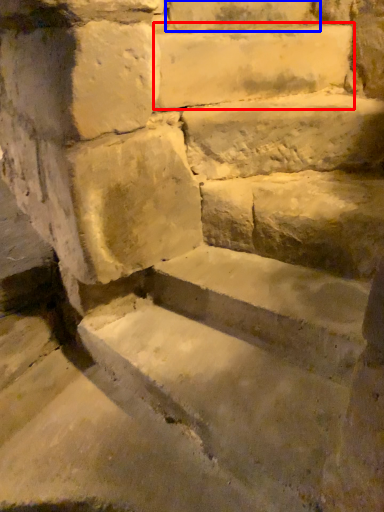
Question: Which point is further to the camera, limestone (highlighted by a red box) or brick (highlighted by a blue box)?

Choices:
 (A) limestone
 (B) brick

Answer: (B)